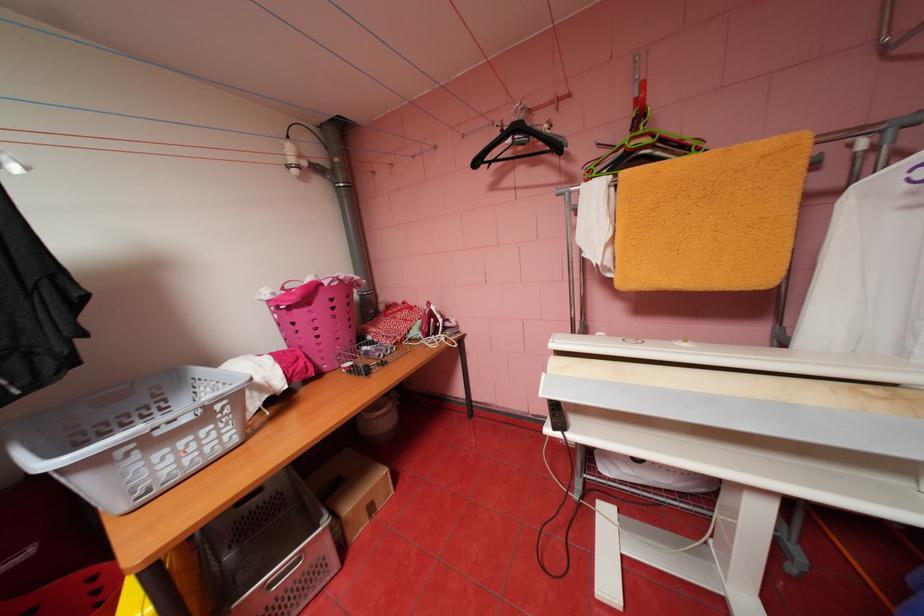
Where is `green clothes hanger`? The height and width of the screenshot is (616, 924). green clothes hanger is located at coordinates (645, 148).